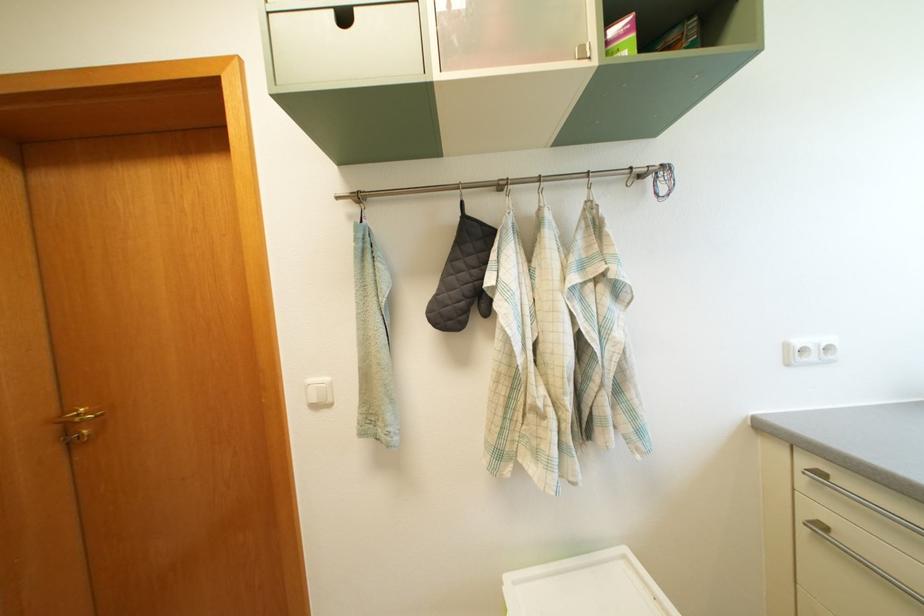
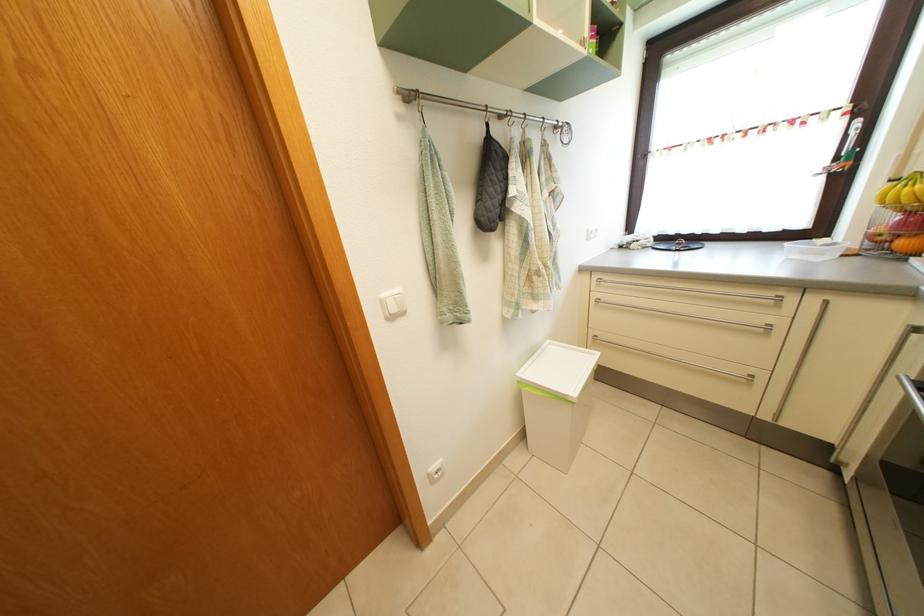
The point at (318, 387) is marked in the first image. Where is the corresponding point in the second image?

(392, 302)